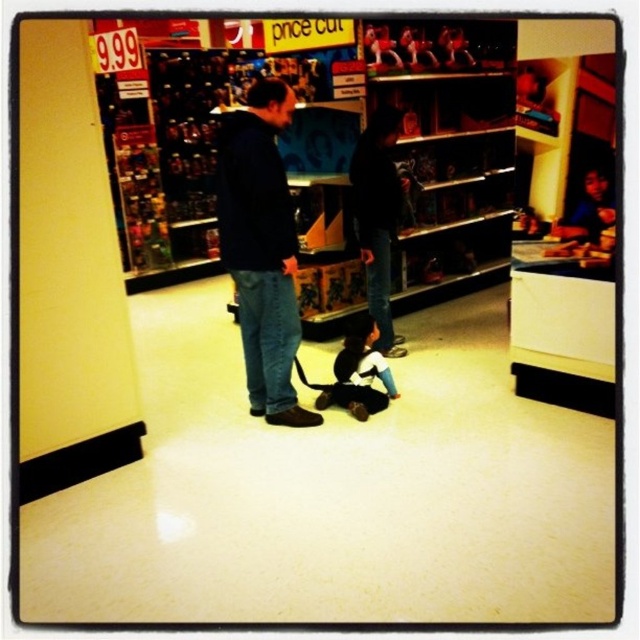
Is point (365, 344) farther from camera compared to point (449, 45)?

No, it is in front of (449, 45).

Consider the image. Who is positioned more to the right, soft plush bear at center or metallic silver toy at upper center?

metallic silver toy at upper center

At what (x,y) coordinates should I click in order to perform the action: click on soft plush bear at center. Please return your answer as a coordinate pair (x, y). Looking at the image, I should click on (356, 372).

Does dark blue hoodie at center appear on the left side of matte pink plush at upper center?

Indeed, dark blue hoodie at center is positioned on the left side of matte pink plush at upper center.

Between dark blue hoodie at center and matte pink plush at upper center, which one has less height?

With less height is matte pink plush at upper center.

Who is more forward, (273,348) or (380,56)?

Point (273,348) is in front.

Locate an element on the screen. dark blue hoodie at center is located at coordinates (260, 248).

Does matte pink plush at upper center have a smaller size compared to metallic silver toy at upper center?

No.

Where is `matte pink plush at upper center`? The height and width of the screenshot is (640, 640). matte pink plush at upper center is located at coordinates (381, 45).

Which is behind, point (396, 44) or point (444, 61)?

Positioned behind is point (444, 61).

At what (x,y) coordinates should I click in order to perform the action: click on matte pink plush at upper center. Please return your answer as a coordinate pair (x, y). This screenshot has height=640, width=640. Looking at the image, I should click on (381, 45).